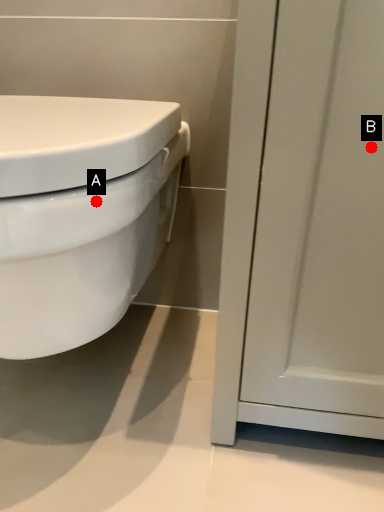
Question: Two points are circled on the image, labeled by A and B beside each circle. Which point is farther to the camera?

Choices:
 (A) A is further
 (B) B is further

Answer: (B)